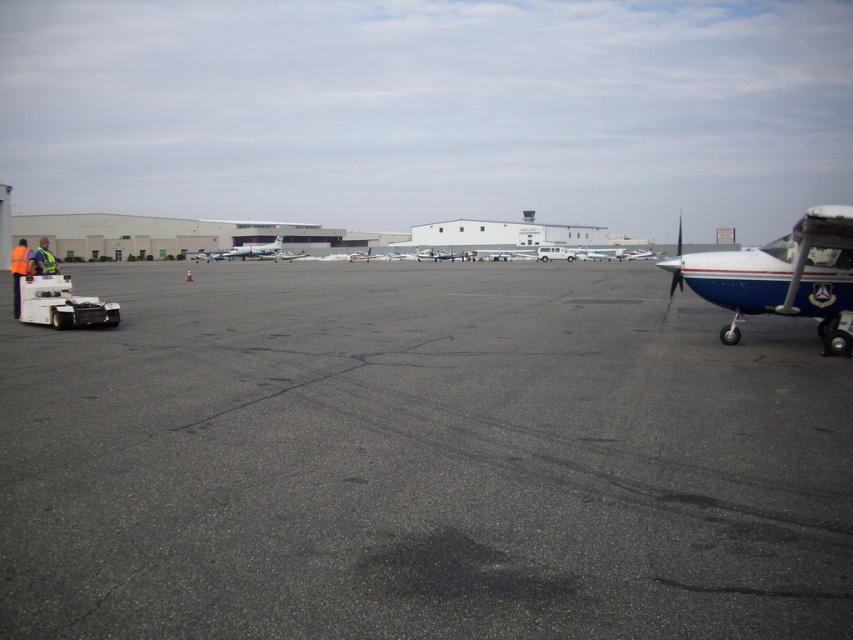
Question: Which point is closer to the camera?

Choices:
 (A) click(x=260, y=248)
 (B) click(x=821, y=307)
 (C) click(x=16, y=314)

Answer: (B)

Question: Which of the following is the farthest from the observer?

Choices:
 (A) (781, 282)
 (B) (55, 259)
 (C) (672, 627)
 (D) (286, 252)

Answer: (D)

Question: Is gray asphalt runway at center bigger than silver metallic airplane at center?

Choices:
 (A) yes
 (B) no

Answer: (A)

Question: Does gray asphalt runway at center appear on the right side of silver metallic airplane at center?

Choices:
 (A) yes
 (B) no

Answer: (A)

Question: Does reflective yellow vest at left lie in front of white glossy airplane at center?

Choices:
 (A) yes
 (B) no

Answer: (A)

Question: Which object is positioned closest to the silver metallic airplane at center?

Choices:
 (A) blue polished airplane at right
 (B) reflective yellow vest at left
 (C) gray asphalt runway at center

Answer: (B)